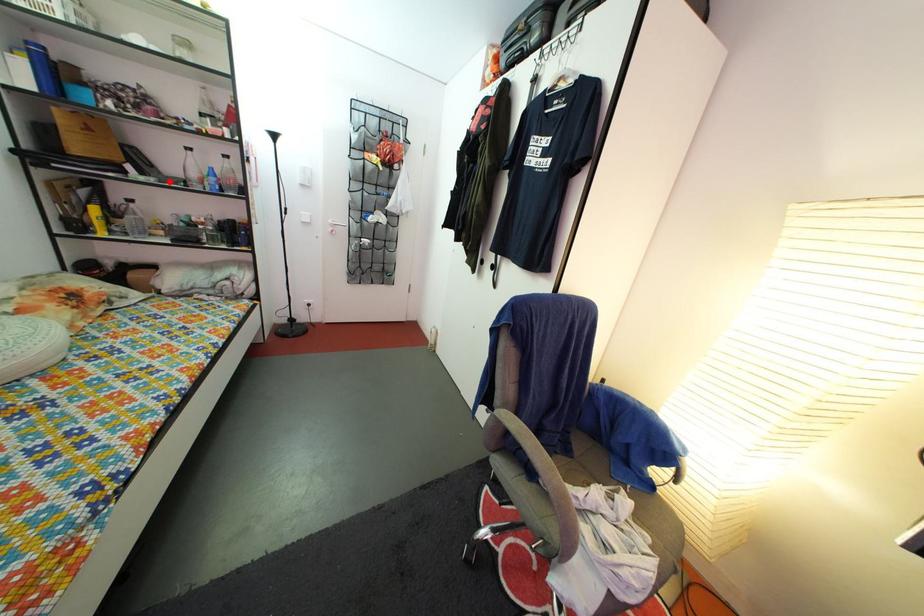
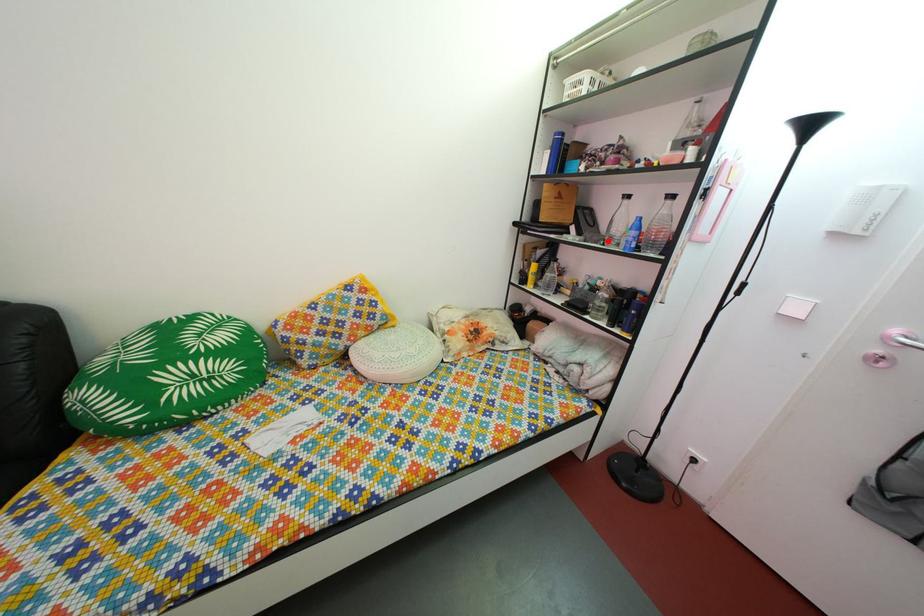
I am providing you with two images of the same scene from different viewpoints. A red point is marked on the first image and another point is marked on the second image. Is the marked point in image1 the same physical position as the marked point in image2?

Yes